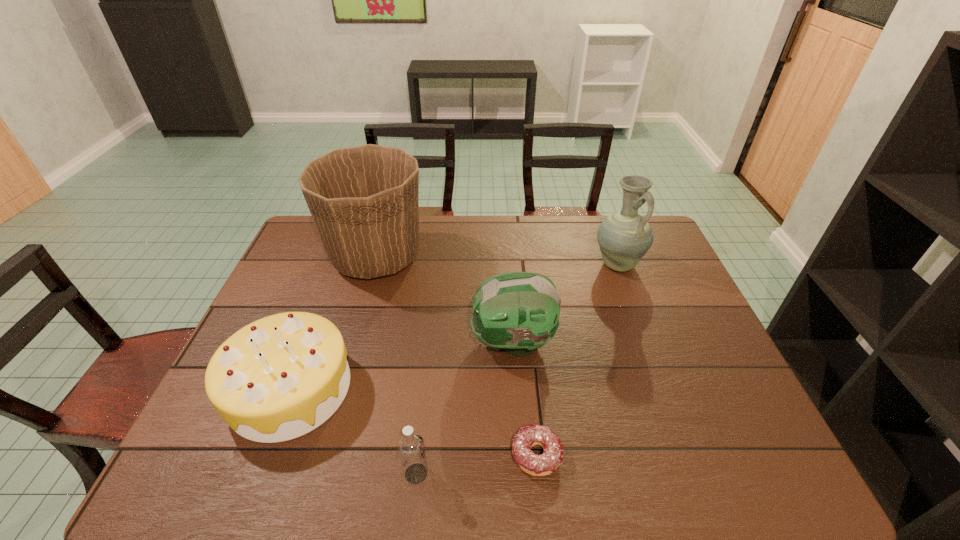
Where is `flowerpot`? The image size is (960, 540). flowerpot is located at coordinates (363, 200).

This screenshot has height=540, width=960. I want to click on the rightmost object, so click(x=624, y=237).

Locate an element on the screen. This screenshot has height=540, width=960. football helmet is located at coordinates tap(518, 311).

This screenshot has height=540, width=960. Find the location of `birthday cake`. birthday cake is located at coordinates (280, 377).

What are the coordinates of `the third object from left to right` in the screenshot? It's located at (411, 448).

Locate an element on the screen. The width and height of the screenshot is (960, 540). the shortest object is located at coordinates (528, 436).

Locate an element on the screen. vacant position located 0.140m on the front of the flowerpot is located at coordinates (357, 325).

You are a GUI agent. You are given a task and a screenshot of the screen. Output one action in this format:
    pyautogui.click(x=<x>, y=<y>)
    Task: Click on the vacant area situated 0.300m on the handle side of the rightmost object
    The width and height of the screenshot is (960, 540).
    Given the screenshot: What is the action you would take?
    pyautogui.click(x=651, y=355)

Identify the location of vacant space situated on the visor of the fourth shortest object. This screenshot has width=960, height=540. (377, 342).

Identify the location of free spot located on the visor of the fourth shortest object. This screenshot has width=960, height=540. (439, 342).